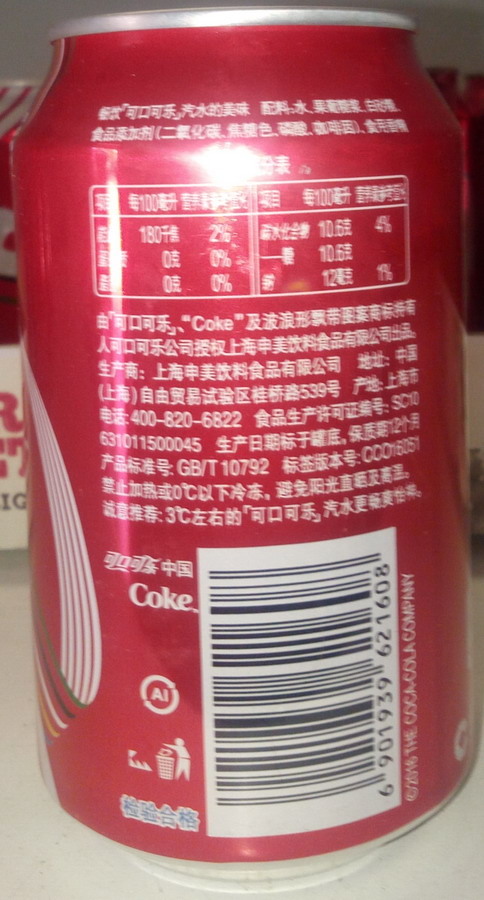
Identify the location of trashcan. (164, 766).